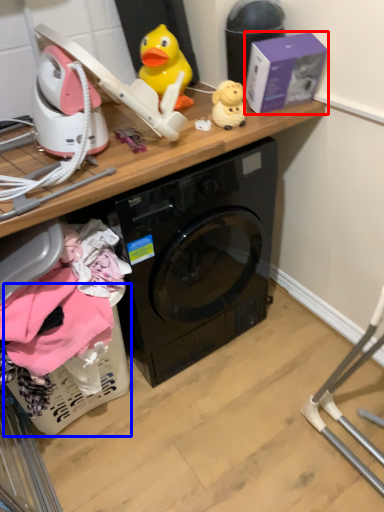
Question: Among these objects, which one is farthest to the camera, box (highlighted by a red box) or basket (highlighted by a blue box)?

Choices:
 (A) box
 (B) basket

Answer: (A)